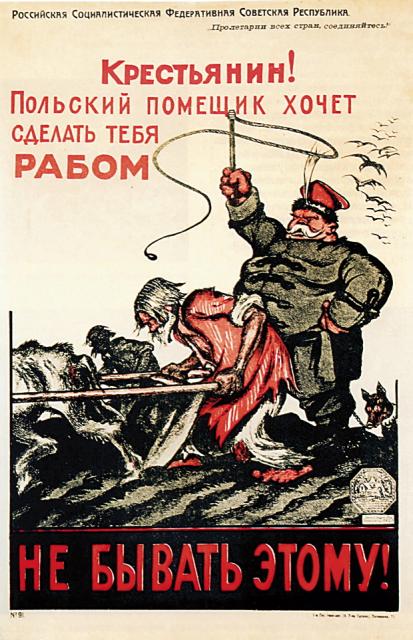
Image resolution: width=413 pixels, height=640 pixels. I want to click on book, so click(123, 180).